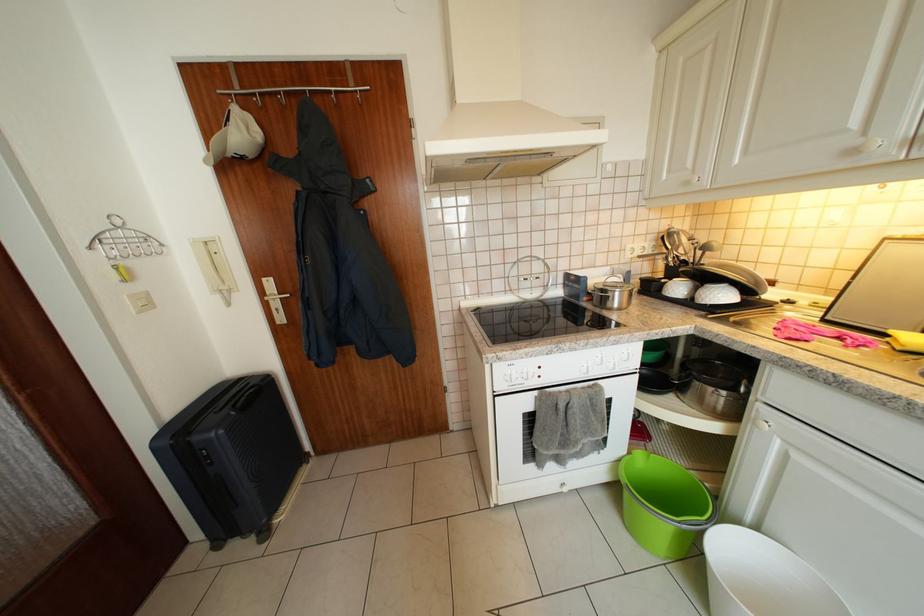
Find the location of `silver cabinet knob`. silver cabinet knob is located at coordinates (761, 424).